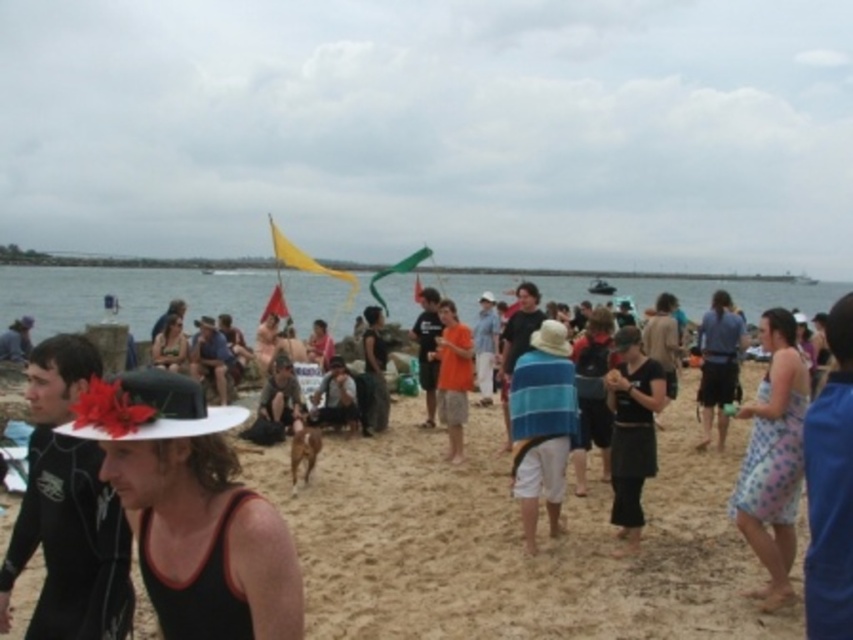
Question: Which point appears farthest from the camera in this image?

Choices:
 (A) (708, 365)
 (B) (531, 358)

Answer: (A)

Question: Among these points, which one is farthest from the camera?

Choices:
 (A) (811, 582)
 (B) (723, 362)
 (C) (526, 525)

Answer: (B)

Question: Which of the following is the farthest from the observer?

Choices:
 (A) black wetsuit at left
 (B) polka dot fabric dress at lower right
 (C) blue striped towel at center

Answer: (C)

Question: In this image, where is blue striped towel at lower right located relative to matte black hat at left?

Choices:
 (A) below
 (B) above

Answer: (A)

Question: Is blue fabric shirt at center-right thinner than orange cotton shirt at center?

Choices:
 (A) yes
 (B) no

Answer: (B)

Question: Does blue fabric shirt at center-right appear on the right side of matte black hat at left?

Choices:
 (A) yes
 (B) no

Answer: (A)